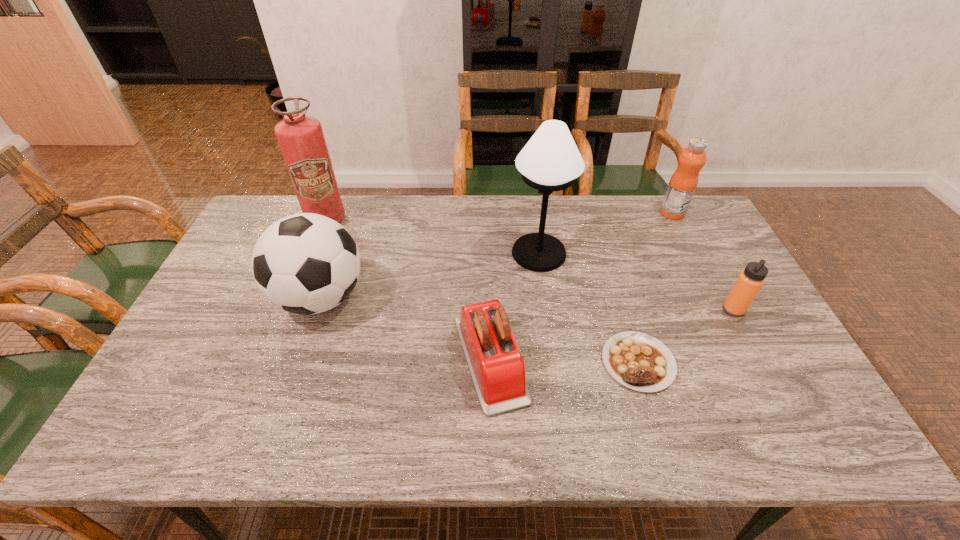
Find the location of a particular element. The width and height of the screenshot is (960, 540). vacant space located 0.200m on the front of the fruit juice is located at coordinates (696, 260).

This screenshot has height=540, width=960. Identify the location of blank space located 0.160m on the front of the soccer ball. (290, 388).

Locate an element on the screen. This screenshot has height=540, width=960. free point located on the front of the thermos bottle is located at coordinates (781, 400).

Find the location of `vacant area located 0.130m on the right of the toaster`. vacant area located 0.130m on the right of the toaster is located at coordinates (579, 360).

Locate an element on the screen. vacant space situated 0.060m on the left of the fifth object from left to right is located at coordinates (579, 362).

In order to click on table lamp that is at the far edge in this screenshot , I will do `click(550, 161)`.

Image resolution: width=960 pixels, height=540 pixels. Find the location of `fire extinguisher situated at the far edge`. fire extinguisher situated at the far edge is located at coordinates (300, 137).

At what (x,y) coordinates should I click in order to perform the action: click on fruit juice that is at the far edge. Please return your answer as a coordinate pair (x, y). Looking at the image, I should click on (682, 185).

I want to click on object located at the near edge, so click(497, 368).

You are a GUI agent. You are given a task and a screenshot of the screen. Output one action in this format:
    pyautogui.click(x=<x>, y=<y>)
    Task: Click on the fruit juice that is at the right edge
    This screenshot has height=540, width=960.
    Given the screenshot: What is the action you would take?
    pyautogui.click(x=682, y=185)